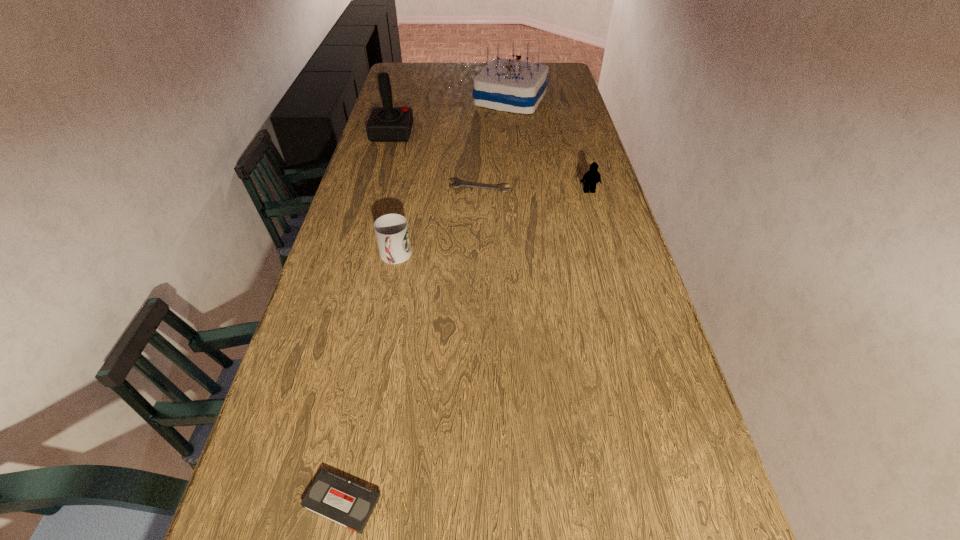
The image size is (960, 540). Find the location of `vacant area situated 0.240m on the handle side of the second nearest object`. vacant area situated 0.240m on the handle side of the second nearest object is located at coordinates (377, 349).

I want to click on vacant space situated 0.110m on the left of the videotape, so point(242,501).

Where is `vacant space positioned 0.280m on the back of the wrench`? The image size is (960, 540). vacant space positioned 0.280m on the back of the wrench is located at coordinates (479, 138).

Identify the location of joystick that is positioned at the left edge. (385, 124).

Identify the location of cup that is at the left edge. Image resolution: width=960 pixels, height=540 pixels. (392, 233).

Identify the location of videotape situated at the left edge. This screenshot has width=960, height=540. (336, 498).

Find the location of a particular element. This screenshot has width=960, height=540. birthday cake at the right edge is located at coordinates (508, 85).

Where is `Lego present at the right edge`? Image resolution: width=960 pixels, height=540 pixels. Lego present at the right edge is located at coordinates (592, 177).

Image resolution: width=960 pixels, height=540 pixels. In the image, there is a desktop. In order to click on vacant region at the far edge in this screenshot , I will do `click(463, 63)`.

Where is `blank area at the left edge`? This screenshot has width=960, height=540. blank area at the left edge is located at coordinates (373, 180).